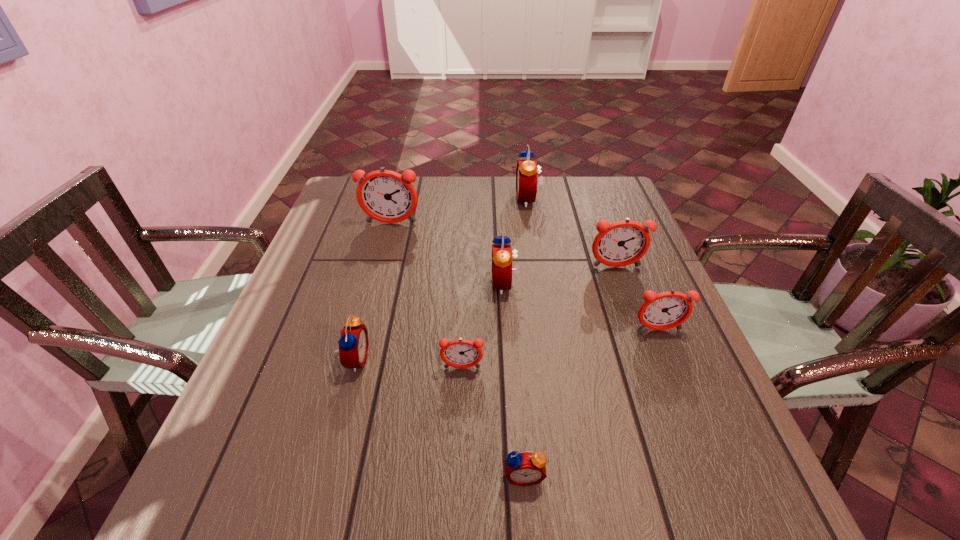
Image resolution: width=960 pixels, height=540 pixels. I want to click on reddish-pink alarm clock that is the third closest to the second biggest reddish-pink alarm clock, so click(x=386, y=196).

Find the location of a particular element. Image resolution: width=960 pixels, height=540 pixels. free space that satisfies the following two spatial constraints: 1. on the front-facing side of the second farthest red alarm clock; 2. on the front-facing side of the third reddish-pink alarm clock from right to left is located at coordinates (510, 368).

At what (x,y) coordinates should I click in order to perform the action: click on vacant space that satisfies the following two spatial constraints: 1. on the front-facing side of the third object from right to left; 2. on the front-facing side of the third reddish-pink alarm clock from right to left. Please return your answer as a coordinate pair (x, y). Looking at the image, I should click on click(554, 368).

Image resolution: width=960 pixels, height=540 pixels. I want to click on vacant space that satisfies the following two spatial constraints: 1. on the front-facing side of the third alarm clock from right to left; 2. on the front-facing side of the leftmost reddish-pink alarm clock, so [x=532, y=224].

You are a GUI agent. You are given a task and a screenshot of the screen. Output one action in this format:
    pyautogui.click(x=<x>, y=<y>)
    Task: Click on the free location that satisfies the following two spatial constraints: 1. on the front-facing side of the farthest red alarm clock; 2. on the front-facing side of the sixth object from right to left
    The height and width of the screenshot is (540, 960).
    Given the screenshot: What is the action you would take?
    pyautogui.click(x=554, y=368)